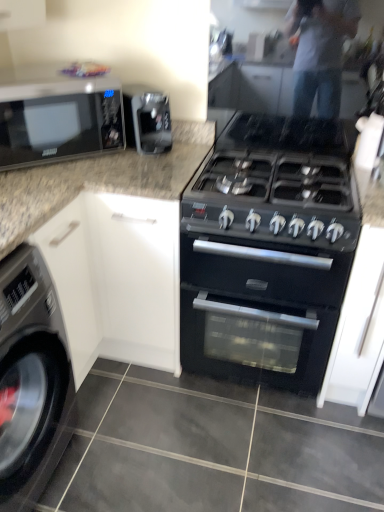
The width and height of the screenshot is (384, 512). What do you see at coordinates (32, 380) in the screenshot? I see `metallic gray washing machine at lower left` at bounding box center [32, 380].

In order to face black glossy microwave at upper left, should I rotate leftwards or rightwards?

Turn left by 18.603 degrees to look at black glossy microwave at upper left.

In order to face satin black coffee machine at upper center, should I rotate leftwards or rightwards?

You should look left and rotate roughly 5.602 degrees.

Find the location of a particular element. metallic gray washing machine at lower left is located at coordinates (32, 380).

From a real-world perspective, who is located higher, metallic gray washing machine at lower left or satin black coffee machine at upper center?

satin black coffee machine at upper center is physically above.

Considering the sizes of metallic gray washing machine at lower left and satin black coffee machine at upper center in the image, is metallic gray washing machine at lower left wider or thinner than satin black coffee machine at upper center?

Clearly, metallic gray washing machine at lower left has more width compared to satin black coffee machine at upper center.

Is metallic gray washing machine at lower left next to satin black coffee machine at upper center and touching it?

No.

Is metallic gray washing machine at lower left inside or outside of satin black coffee machine at upper center?

metallic gray washing machine at lower left is outside satin black coffee machine at upper center.

Which object is closer to the camera, black matte oven at center or metallic gray washing machine at lower left?

metallic gray washing machine at lower left is closer to the camera.

Which is behind, point (243, 270) or point (53, 314)?

The point (243, 270) is behind.

Is black matte oven at center oriented towards metallic gray washing machine at lower left?

No, black matte oven at center is not facing towards metallic gray washing machine at lower left.

From the image's perspective, does black matte oven at center appear lower than metallic gray washing machine at lower left?

No, from the image's perspective, black matte oven at center is not beneath metallic gray washing machine at lower left.

In terms of width, does satin black coffee machine at upper center look wider or thinner when compared to metallic gray washing machine at lower left?

satin black coffee machine at upper center is thinner than metallic gray washing machine at lower left.

Does satin black coffee machine at upper center have a lesser height compared to metallic gray washing machine at lower left?

Yes.

From a real-world perspective, is satin black coffee machine at upper center over metallic gray washing machine at lower left?

Indeed, from a real-world perspective, satin black coffee machine at upper center stands above metallic gray washing machine at lower left.

Is black glossy microwave at upper left in contact with metallic gray washing machine at lower left?

black glossy microwave at upper left is not next to metallic gray washing machine at lower left, and they're not touching.

Could you tell me if black glossy microwave at upper left is facing metallic gray washing machine at lower left?

No.

From the image's perspective, between black glossy microwave at upper left and metallic gray washing machine at lower left, which one is located above?

black glossy microwave at upper left appears higher in the image.

This screenshot has height=512, width=384. In the image, there is a black glossy microwave at upper left. Find the location of `washing machine below it (from a real-world perspective)`. washing machine below it (from a real-world perspective) is located at coordinates click(32, 380).

How far apart are black matte oven at center and black glossy microwave at upper left?

black matte oven at center and black glossy microwave at upper left are 30.50 inches apart.

In the scene shown: Does black matte oven at center touch black glossy microwave at upper left?

No, black matte oven at center is not touching black glossy microwave at upper left.

At what (x,y) coordinates should I click in order to perform the action: click on oven directly beneath the black glossy microwave at upper left (from a real-world perspective). Please return your answer as a coordinate pair (x, y). Looking at the image, I should click on (258, 316).

Is black matte oven at center bigger or smaller than black glossy microwave at upper left?

Clearly, black matte oven at center is larger in size than black glossy microwave at upper left.

Are black matte gas stove at center and metallic gray washing machine at lower left located far from each other?

That's not correct — black matte gas stove at center is a little close to metallic gray washing machine at lower left.

From a real-world perspective, is black matte gas stove at center under metallic gray washing machine at lower left?

Incorrect, from a real-world perspective, black matte gas stove at center is higher than metallic gray washing machine at lower left.

Does black matte gas stove at center have a greater width compared to metallic gray washing machine at lower left?

Correct, the width of black matte gas stove at center exceeds that of metallic gray washing machine at lower left.

From the image's perspective, is black matte oven at center on top of satin black coffee machine at upper center?

No, from the image's perspective, black matte oven at center is not on top of satin black coffee machine at upper center.

From a real-world perspective, is black matte oven at center under satin black coffee machine at upper center?

Yes, from a real-world perspective, black matte oven at center is under satin black coffee machine at upper center.

Locate an element on the screen. The image size is (384, 512). oven below the satin black coffee machine at upper center (from a real-world perspective) is located at coordinates (258, 316).

In the image, there is a metallic gray washing machine at lower left. In order to click on appliance above it (from the image's perspective) in this screenshot , I will do `click(147, 120)`.

The image size is (384, 512). I want to click on washing machine that appears in front of the black matte oven at center, so click(32, 380).

Considering their positions, is black matte oven at center positioned closer to satin black coffee machine at upper center than black matte gas stove at center?

Among the two, black matte gas stove at center is located nearer to satin black coffee machine at upper center.

When comparing their distances from metallic gray washing machine at lower left, does satin black coffee machine at upper center or black matte oven at center seem closer?

Based on the image, black matte oven at center appears to be nearer to metallic gray washing machine at lower left.

Looking at the image, which one is located further to black matte gas stove at center, black matte oven at center or black glossy microwave at upper left?

black glossy microwave at upper left is further to black matte gas stove at center.

Based on their spatial positions, is satin black coffee machine at upper center or black matte oven at center closer to black matte gas stove at center?

Based on the image, satin black coffee machine at upper center appears to be nearer to black matte gas stove at center.

In the scene shown: When comparing their distances from black matte gas stove at center, does satin black coffee machine at upper center or metallic gray washing machine at lower left seem further?

metallic gray washing machine at lower left.

Estimate the real-world distances between objects in this image. Which object is closer to satin black coffee machine at upper center, black matte gas stove at center or black matte oven at center?

black matte gas stove at center.

Which object lies nearer to the anchor point metallic gray washing machine at lower left, black matte oven at center or satin black coffee machine at upper center?

Among the two, black matte oven at center is located nearer to metallic gray washing machine at lower left.

In the scene shown: From the image, which object appears to be farther from satin black coffee machine at upper center, metallic gray washing machine at lower left or black glossy microwave at upper left?

The object further to satin black coffee machine at upper center is metallic gray washing machine at lower left.

At what (x,y) coordinates should I click in order to perform the action: click on oven between black glossy microwave at upper left and black matte gas stove at center. Please return your answer as a coordinate pair (x, y). The width and height of the screenshot is (384, 512). Looking at the image, I should click on [x=258, y=316].

Where is `appliance between metallic gray washing machine at lower left and black matte oven at center from left to right`? appliance between metallic gray washing machine at lower left and black matte oven at center from left to right is located at coordinates (x=147, y=120).

Locate an element on the screen. appliance located between metallic gray washing machine at lower left and black matte gas stove at center in the left-right direction is located at coordinates (147, 120).

The image size is (384, 512). I want to click on appliance situated between black glossy microwave at upper left and black matte oven at center from left to right, so click(147, 120).